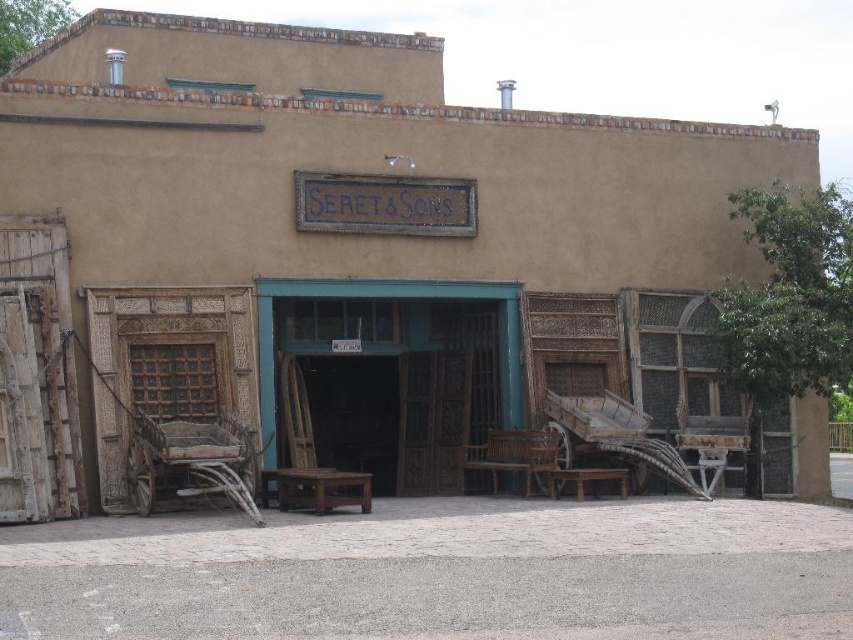
Measure the distance between wooden chair at center and camera.

wooden chair at center and camera are 20.29 meters apart.

Between wooden chair at center and brown wooden bench at center, which one appears on the right side from the viewer's perspective?

From the viewer's perspective, wooden chair at center appears more on the right side.

Where is `wooden chair at center`? This screenshot has height=640, width=853. wooden chair at center is located at coordinates (711, 440).

The width and height of the screenshot is (853, 640). Find the location of `wooden chair at center`. wooden chair at center is located at coordinates (711, 440).

Is wooden bench at center below brown wooden bench at center?

Actually, wooden bench at center is above brown wooden bench at center.

Does point (376, 289) come farther from viewer compared to point (473, 454)?

No, (376, 289) is closer to viewer.

Image resolution: width=853 pixels, height=640 pixels. Describe the element at coordinates (389, 298) in the screenshot. I see `wooden bench at center` at that location.

Where is `wooden bench at center`? The height and width of the screenshot is (640, 853). wooden bench at center is located at coordinates (389, 298).

Which is above, wooden bench at center or wooden chair at center?

wooden bench at center

Who is positioned more to the left, wooden bench at center or wooden chair at center?

From the viewer's perspective, wooden bench at center appears more on the left side.

Locate an element on the screen. Image resolution: width=853 pixels, height=640 pixels. wooden bench at center is located at coordinates (389, 298).